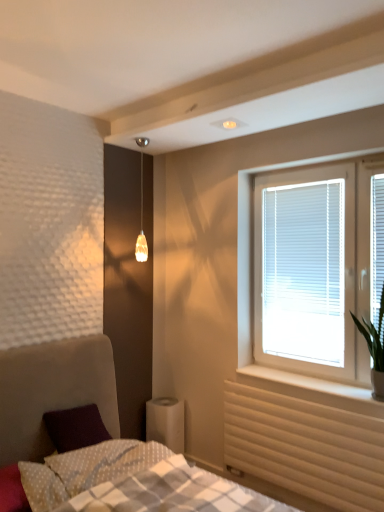
Question: From the image's perspective, does white textured bed at lower left appear lower than white plastic blinds at right, which is the 2th window screen from back to front?

Choices:
 (A) yes
 (B) no

Answer: (A)

Question: Is white textured bed at lower left to the left of white plastic blinds at right, placed as the 2th window screen when sorted from left to right, from the viewer's perspective?

Choices:
 (A) yes
 (B) no

Answer: (A)

Question: Does white textured bed at lower left lie in front of white plastic blinds at right, which is the first window screen from front to back?

Choices:
 (A) yes
 (B) no

Answer: (A)

Question: Is white plastic blinds at right, which is the 2th window screen from back to front, completely or partially inside white textured bed at lower left?

Choices:
 (A) no
 (B) yes

Answer: (A)

Question: Is white textured bed at lower left placed right next to white plastic blinds at right, which appears as the first window screen when viewed from the right?

Choices:
 (A) no
 (B) yes

Answer: (A)

Question: Could you tell me if white textured bed at lower left is facing white plastic blinds at right, which is the 2th window screen from back to front?

Choices:
 (A) yes
 (B) no

Answer: (B)

Question: From the image's perspective, is white plastic blinds at right, which is the 2th window screen from back to front, under white dotted fabric pillow at lower left, the 2th pillow positioned from the right?

Choices:
 (A) yes
 (B) no

Answer: (B)

Question: Considering the relative sizes of white plastic blinds at right, placed as the 2th window screen when sorted from left to right, and white dotted fabric pillow at lower left, the 2th pillow positioned from the right, in the image provided, is white plastic blinds at right, placed as the 2th window screen when sorted from left to right, smaller than white dotted fabric pillow at lower left, the 2th pillow positioned from the right,?

Choices:
 (A) no
 (B) yes

Answer: (B)

Question: From a real-world perspective, is white plastic blinds at right, which appears as the first window screen when viewed from the right, over white dotted fabric pillow at lower left, which is counted as the 1th pillow, starting from the left?

Choices:
 (A) yes
 (B) no

Answer: (A)

Question: Does white plastic blinds at right, which is the first window screen from front to back, lie in front of white dotted fabric pillow at lower left, the 2th pillow positioned from the right?

Choices:
 (A) no
 (B) yes

Answer: (A)

Question: Is white plastic blinds at right, which is the 2th window screen from back to front, next to white dotted fabric pillow at lower left, the 2th pillow positioned from the right?

Choices:
 (A) no
 (B) yes

Answer: (A)

Question: From a real-world perspective, is white plastic blinds at right, which is the first window screen from front to back, beneath white dotted fabric pillow at lower left, the 2th pillow positioned from the right?

Choices:
 (A) yes
 (B) no

Answer: (B)

Question: Is beige textured radiator at lower right oriented away from translucent amber glass pendant light at upper center?

Choices:
 (A) no
 (B) yes

Answer: (A)